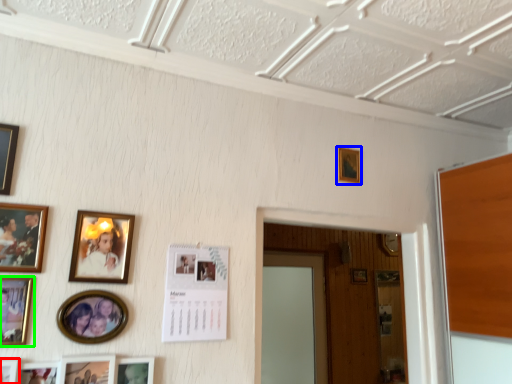
Question: Which object is positioned farthest from picture frame (highlighted by a red box)? Select from picture frame (highlighted by a blue box) and picture frame (highlighted by a green box).

Choices:
 (A) picture frame
 (B) picture frame

Answer: (A)